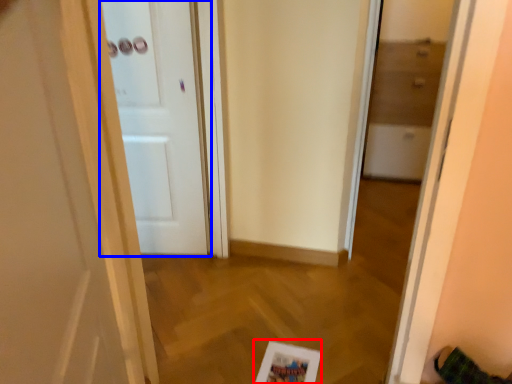
Question: Which object appears farthest to the camera in this image, picture frame (highlighted by a red box) or door (highlighted by a blue box)?

Choices:
 (A) picture frame
 (B) door

Answer: (B)